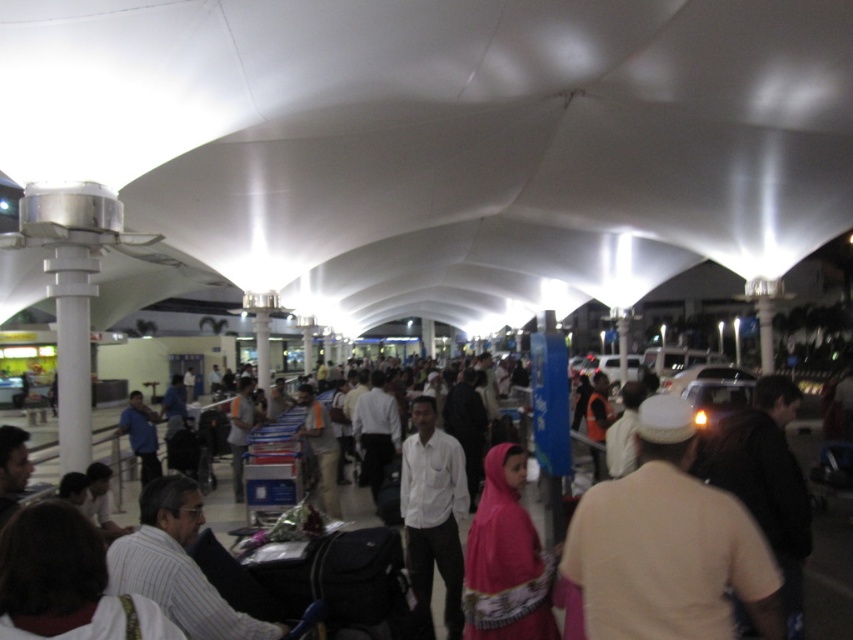
Which is more to the left, white striped shirt at lower left or brown fabric backpack at right?

Positioned to the left is white striped shirt at lower left.

Looking at this image, can you confirm if white striped shirt at lower left is positioned above brown fabric backpack at right?

Yes, white striped shirt at lower left is above brown fabric backpack at right.

Image resolution: width=853 pixels, height=640 pixels. I want to click on white striped shirt at lower left, so click(67, 582).

Does beige cotton shirt at center appear on the right side of pink satin dress at center?

Yes, beige cotton shirt at center is to the right of pink satin dress at center.

Between point (596, 538) and point (555, 625), which one is positioned in front?

Point (596, 538)

You are a GUI agent. You are given a task and a screenshot of the screen. Output one action in this format:
    pyautogui.click(x=<x>, y=<y>)
    Task: Click on the beige cotton shirt at center
    Image resolution: width=853 pixels, height=640 pixels.
    Given the screenshot: What is the action you would take?
    pyautogui.click(x=668, y=545)

Is beige cotton shirt at center to the left of brown fabric backpack at right from the viewer's perspective?

Indeed, beige cotton shirt at center is positioned on the left side of brown fabric backpack at right.

Which is in front, point (647, 400) or point (788, 605)?

Positioned in front is point (647, 400).

Is point (645, 472) behind point (741, 452)?

No.

Image resolution: width=853 pixels, height=640 pixels. Identify the location of beige cotton shirt at center. (668, 545).